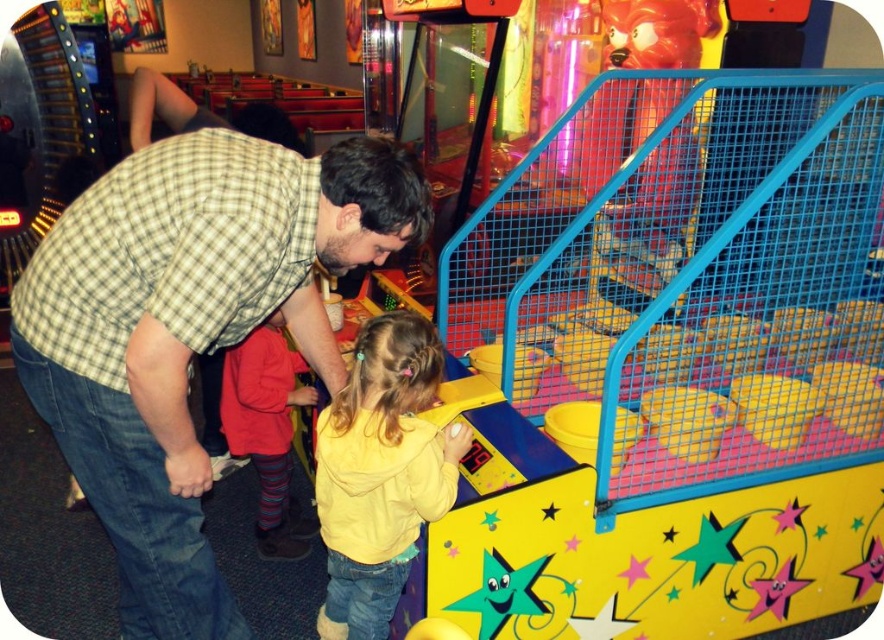
You are trying to determine which piece of clothing is wider between the checkered fabric shirt at center and the red knit sweater at lower left. Which one is wider?

The checkered fabric shirt at center is wider than the red knit sweater at lower left.

You are a delivery person who needs to place a small package between the checkered fabric shirt at center and the red knit sweater at lower left. Can you fit the package if it measures 60 centimeters in length?

The distance between the checkered fabric shirt at center and the red knit sweater at lower left is 56.96 centimeters, so the 60 centimeter package cannot fit as it is longer than the available space.

You are standing in front of the claw machine and want to hand a prize to the person wearing the checkered fabric shirt at center and the yellow fleece jacket at center. Which one can you reach first without moving?

The checkered fabric shirt at center is closer to the viewer than the yellow fleece jacket at center, so you can reach the person wearing the checkered fabric shirt at center first.